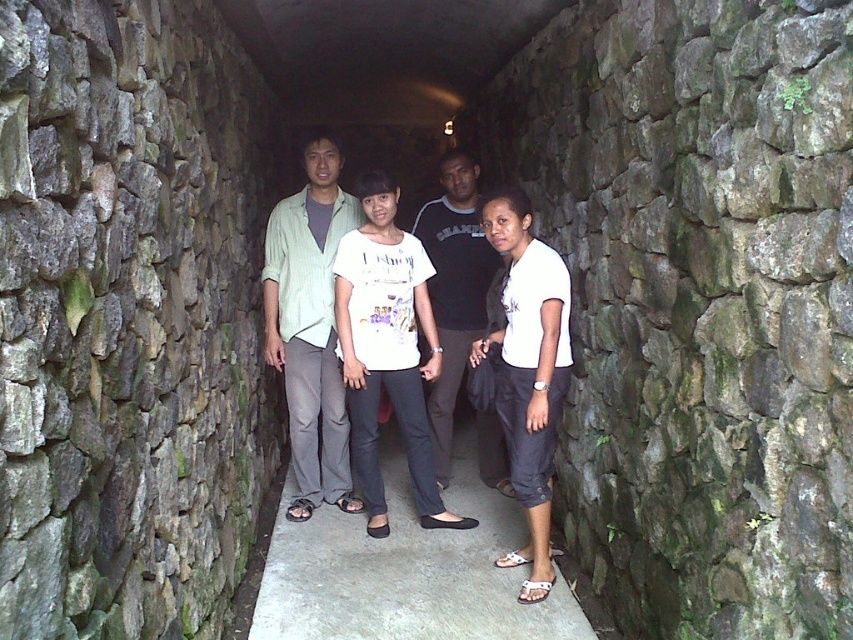
Between light green fabric shirt at center and black cotton shirt at center, which one appears on the right side from the viewer's perspective?

Positioned to the right is black cotton shirt at center.

Between light green fabric shirt at center and black cotton shirt at center, which one has more height?

With more height is light green fabric shirt at center.

Does point (303, 417) come farther from viewer compared to point (433, 312)?

No, it is in front of (433, 312).

Find the location of a particular element. The width and height of the screenshot is (853, 640). light green fabric shirt at center is located at coordinates (310, 326).

Is point (548, 330) positioned after point (488, 445)?

No, (548, 330) is closer to viewer.

Between point (527, 256) and point (482, 433), which one is positioned in front?

Positioned in front is point (527, 256).

Image resolution: width=853 pixels, height=640 pixels. What are the coordinates of `white cotton shirt at center` in the screenshot? It's located at tap(527, 371).

Does light green fabric shirt at center have a lesser width compared to white cotton shirt at center?

Incorrect, light green fabric shirt at center's width is not less than white cotton shirt at center's.

Is light green fabric shirt at center bigger than white cotton shirt at center?

Yes, light green fabric shirt at center is bigger than white cotton shirt at center.

Who is more distant from viewer, (306, 189) or (534, 289)?

Point (306, 189)

The image size is (853, 640). Find the location of `light green fabric shirt at center`. light green fabric shirt at center is located at coordinates (310, 326).